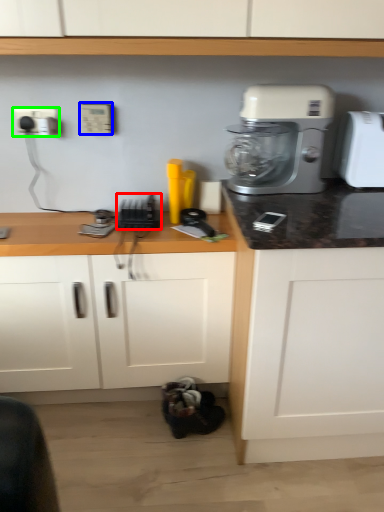
Question: Which object is the closest to the appliance (highlighted by a red box)? Choose among these: electric outlet (highlighted by a blue box) or electric outlet (highlighted by a green box).

Choices:
 (A) electric outlet
 (B) electric outlet

Answer: (A)